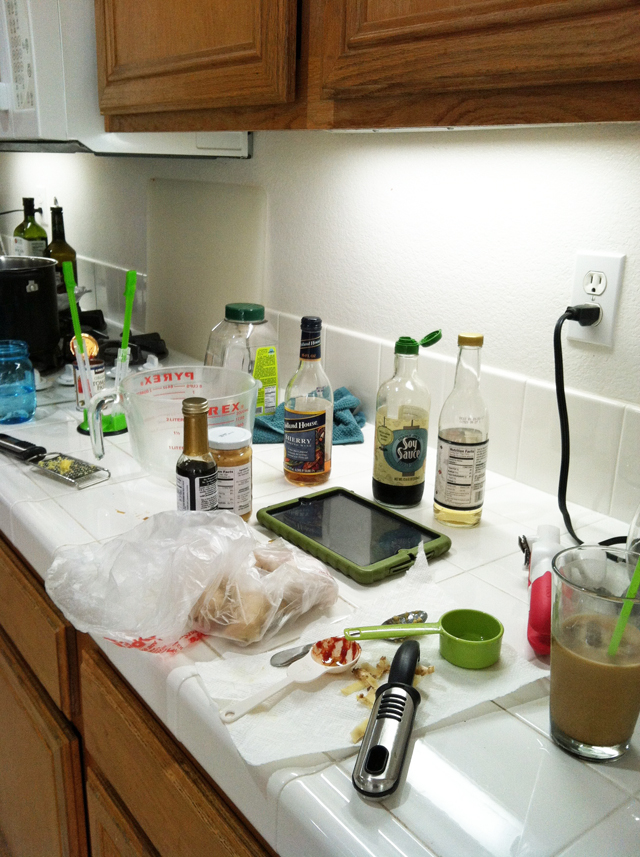
At what (x,y) coordinates should I click in order to perform the action: click on paper towel white. Please return your answer as a coordinate pair (x, y). This screenshot has height=857, width=640. Looking at the image, I should click on (305, 734).